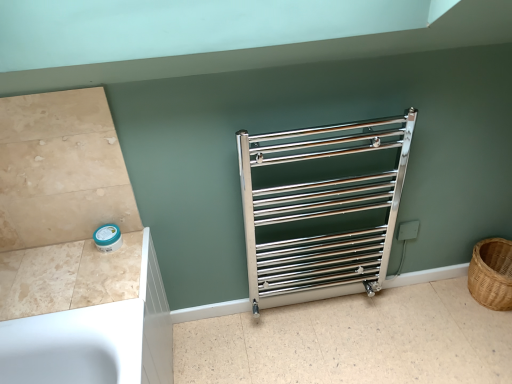
The image size is (512, 384). What are the coordinates of `free spot in front of polished chrome towel rack at center` in the screenshot? It's located at [330, 347].